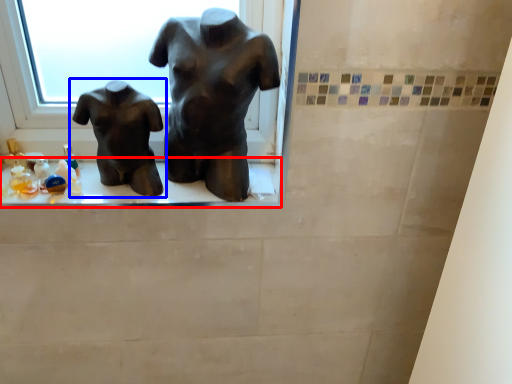
Question: Which object appears farthest to the camera in this image, window sill (highlighted by a red box) or statue (sculpture) (highlighted by a blue box)?

Choices:
 (A) window sill
 (B) statue (sculpture)

Answer: (A)